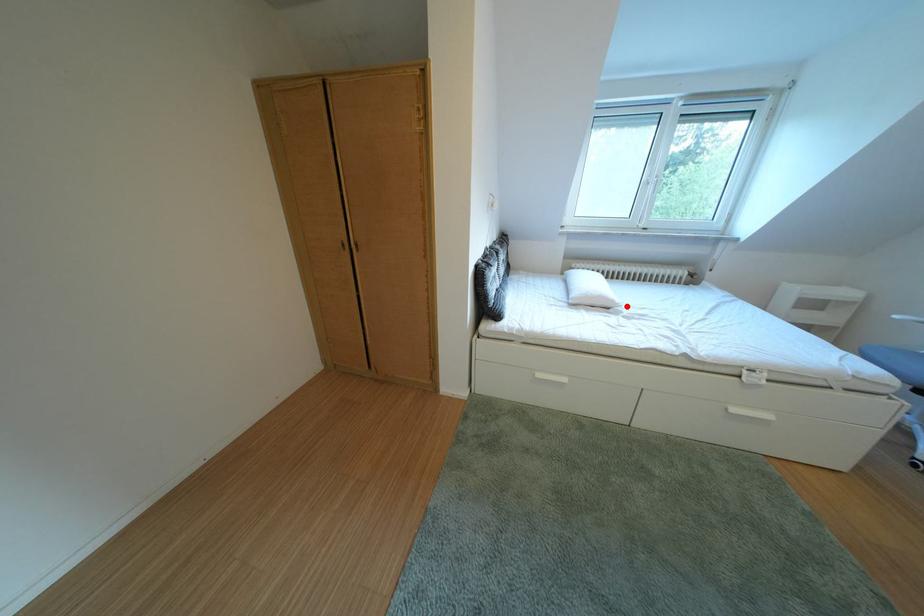
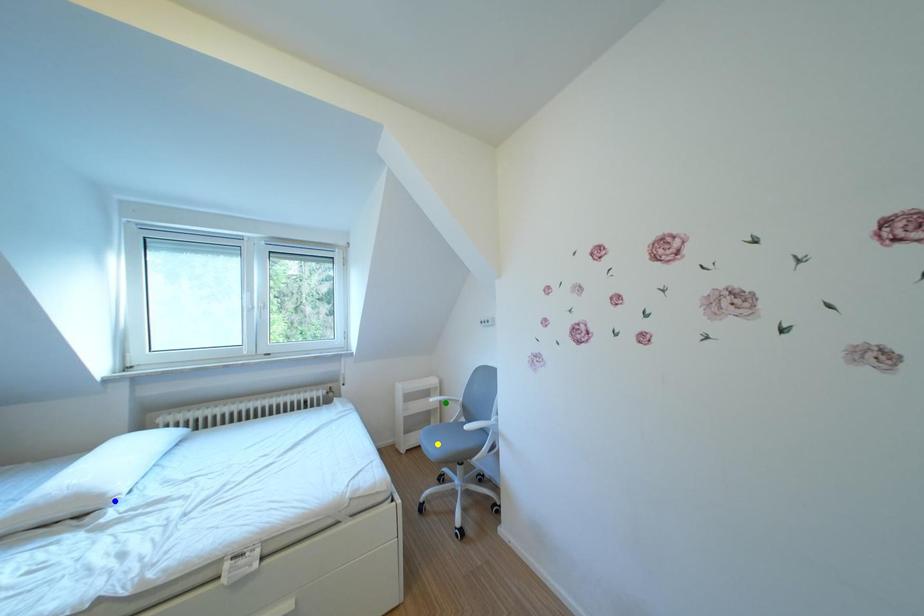
Question: I am providing you with two images of the same scene from different viewpoints. A red point is marked on the first image. You are given multiple points on the second image. Which spot in image 2 lines up with the point in image 1?

Choices:
 (A) green point
 (B) yellow point
 (C) blue point

Answer: (C)